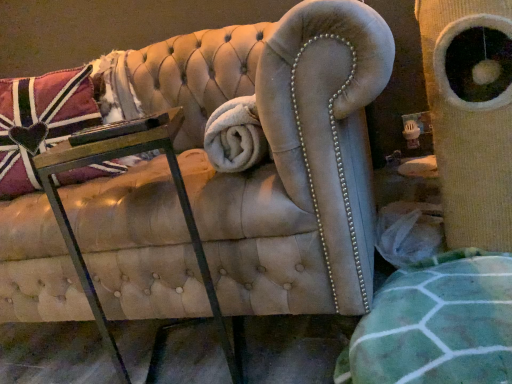
Question: In terms of width, does metal/glass table at lower left look wider or thinner when compared to velvet union jack pillow at upper left?

Choices:
 (A) thin
 (B) wide

Answer: (B)

Question: From a real-world perspective, is metal/glass table at lower left above or below velvet union jack pillow at upper left?

Choices:
 (A) below
 (B) above

Answer: (A)

Question: From the image's perspective, is metal/glass table at lower left positioned above or below velvet union jack pillow at upper left?

Choices:
 (A) above
 (B) below

Answer: (B)

Question: From their relative heights in the image, would you say velvet union jack pillow at upper left is taller or shorter than metal/glass table at lower left?

Choices:
 (A) short
 (B) tall

Answer: (A)

Question: Is velvet union jack pillow at upper left to the left or to the right of metal/glass table at lower left in the image?

Choices:
 (A) right
 (B) left

Answer: (B)

Question: From a real-world perspective, is velvet union jack pillow at upper left physically located above or below metal/glass table at lower left?

Choices:
 (A) below
 (B) above

Answer: (B)

Question: Based on their sizes in the image, would you say velvet union jack pillow at upper left is bigger or smaller than metal/glass table at lower left?

Choices:
 (A) small
 (B) big

Answer: (B)